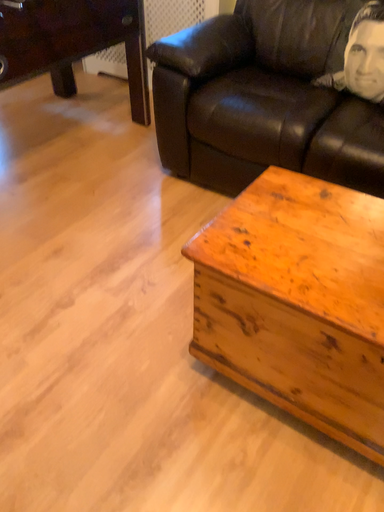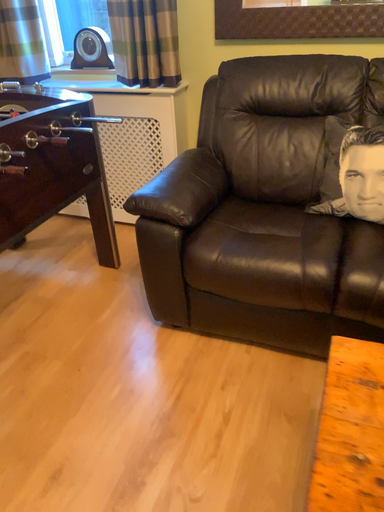
Question: Which way did the camera rotate in the video?

Choices:
 (A) rotated upward
 (B) rotated downward

Answer: (A)